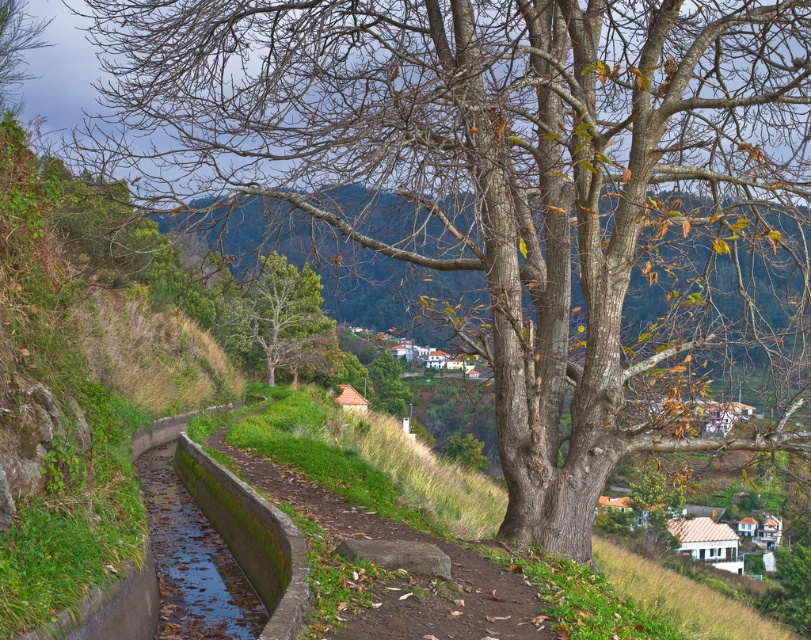
You are standing on the green mossy concrete at center and want to see the view behind the green leafy tree at center. Can you see over it?

The green mossy concrete at center is shorter than the green leafy tree at center, so you cannot see over the tree.

You are standing at the point with coordinates point (265, 266) and want to walk towards the point with coordinates point (194, 541). Given the narrow pathway and the stone wall bordering it, will you have to walk against the direction the path is curving?

Since point (194, 541) is in front of point (265, 266), you are moving in the direction the path is curving, so you won

You are a hiker standing at the start of the pathway in this rural landscape. You need to reach the green mossy concrete at center before continuing your hike. Which direction should you walk relative to the brown matte tree at upper left?

You should walk to the right of the brown matte tree at upper left to reach the green mossy concrete at center since it is located to the right of the tree.